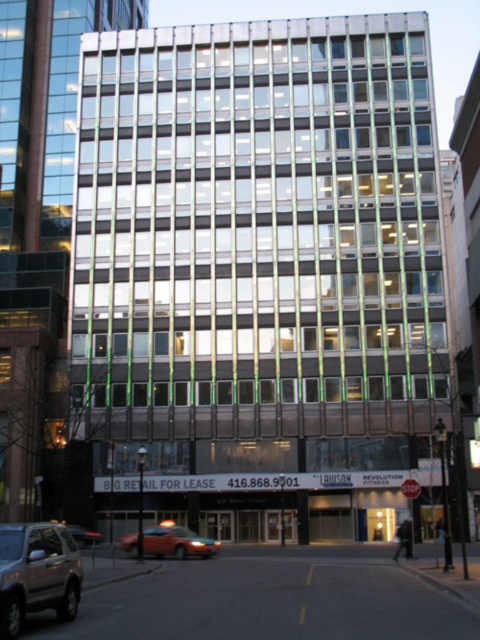
You are a pedestrian standing in front of the building and see both the orange matte taxi at lower left and the metallic silver taxi at lower left. Which taxi is taller?

The orange matte taxi at lower left is taller than the metallic silver taxi at lower left.

You are a delivery person needing to park your 2.5 meter wide van between the orange matte taxi at lower left and the metallic silver taxi at lower left. Can you fit your van there?

The distance between the orange matte taxi at lower left and the metallic silver taxi at lower left is 5.59 meters. Since your van is 2.5 meters wide, there is enough space to park it between them.